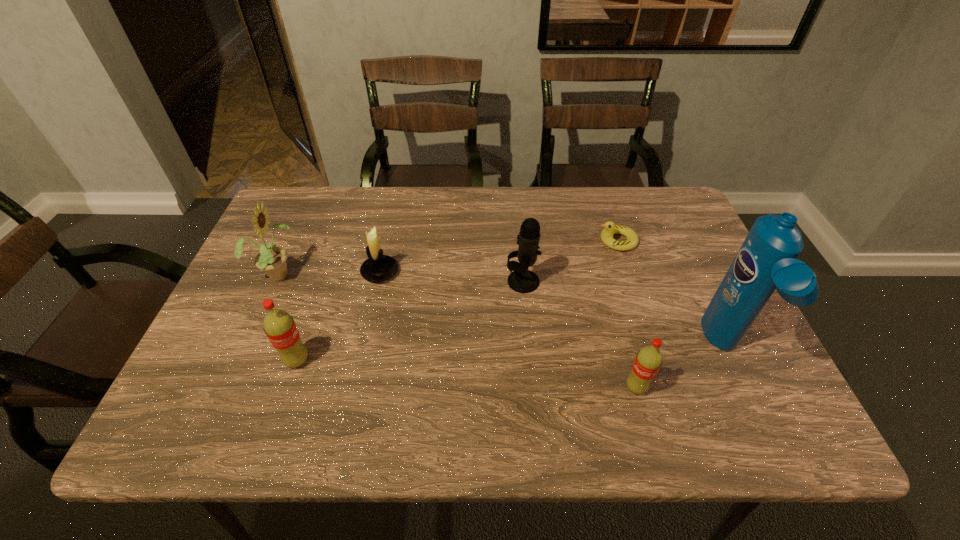
To make them evenly spaced by inserting another pop_(soda) among them, please locate a vacant spot for this new pop_(soda). Please provide its 2D coordinates. Your answer should be formatted as a tuple, i.e. [(x, y)], where the tuple contains the x and y coordinates of a point satisfying the conditions above.

[(463, 374)]